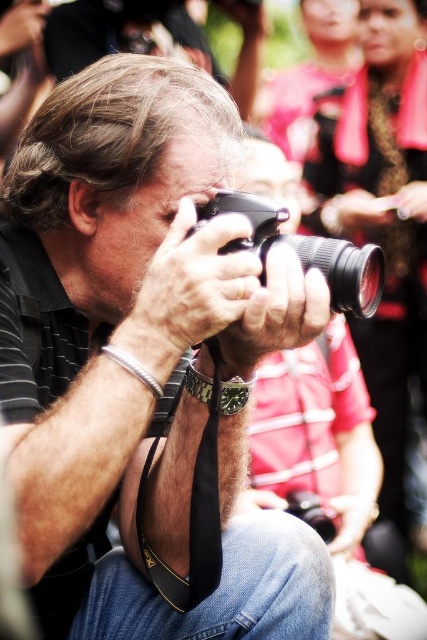
Question: Does matte black camera at center come behind black plastic camera at center?

Choices:
 (A) no
 (B) yes

Answer: (A)

Question: Which object appears farthest from the camera in this image?

Choices:
 (A) matte black camera at center
 (B) black plastic camera at center

Answer: (B)

Question: In this image, where is matte black camera at center located relative to black plastic camera at center?

Choices:
 (A) above
 (B) below

Answer: (B)

Question: Can you confirm if matte black camera at center is smaller than black plastic camera at center?

Choices:
 (A) no
 (B) yes

Answer: (A)